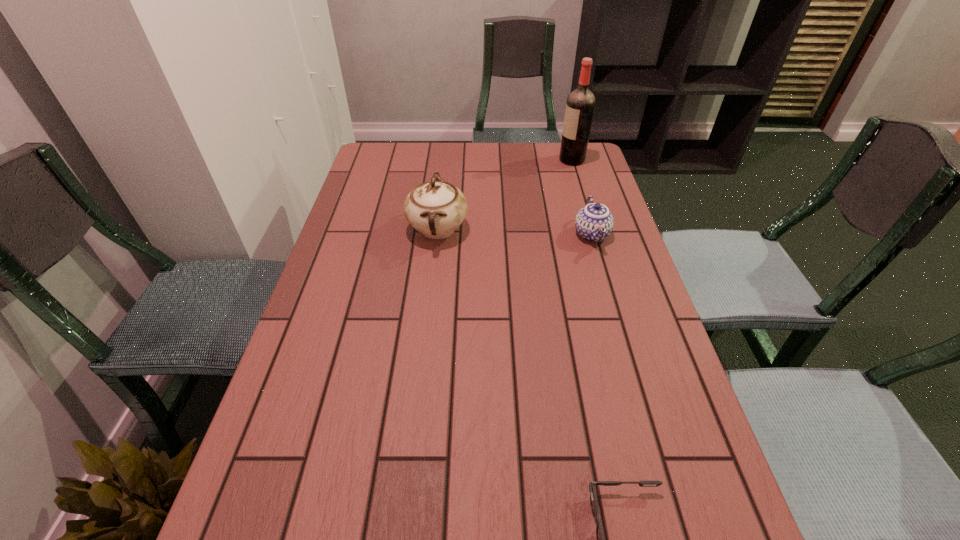
The width and height of the screenshot is (960, 540). I want to click on vacant area situated from the spout of the second shortest object, so click(602, 269).

The image size is (960, 540). What are the coordinates of `object that is at the far edge` in the screenshot? It's located at (580, 104).

Identify the location of liquor that is at the right edge. The width and height of the screenshot is (960, 540). (580, 104).

At what (x,y) coordinates should I click in order to perform the action: click on chinaware present at the right edge. Please return your answer as a coordinate pair (x, y). The height and width of the screenshot is (540, 960). Looking at the image, I should click on (594, 222).

Where is `object that is at the far right corner`? object that is at the far right corner is located at coordinates (580, 104).

Identify the location of vacant space at the far edge of the desktop. Image resolution: width=960 pixels, height=540 pixels. (455, 171).

In the image, there is a desktop. At what (x,y) coordinates should I click in order to perform the action: click on free space at the left edge. Please return your answer as a coordinate pair (x, y). Looking at the image, I should click on (380, 295).

Where is `vacant space at the right edge of the desktop`? The height and width of the screenshot is (540, 960). vacant space at the right edge of the desktop is located at coordinates (615, 298).

Find the location of `empty space between the left chinaware and the farthest object`. empty space between the left chinaware and the farthest object is located at coordinates (505, 194).

Where is `free space between the taller chinaware and the shorter chinaware`? The width and height of the screenshot is (960, 540). free space between the taller chinaware and the shorter chinaware is located at coordinates (515, 232).